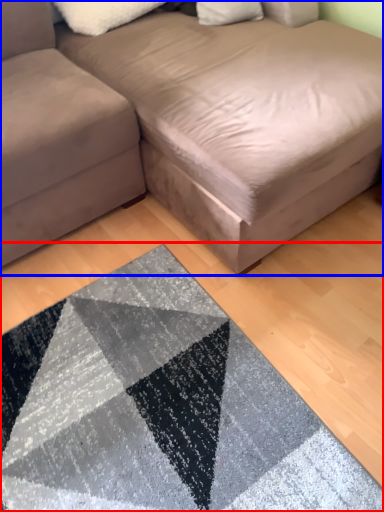
Question: Among these objects, which one is farthest to the camera, mat (highlighted by a red box) or studio couch (highlighted by a blue box)?

Choices:
 (A) mat
 (B) studio couch

Answer: (A)